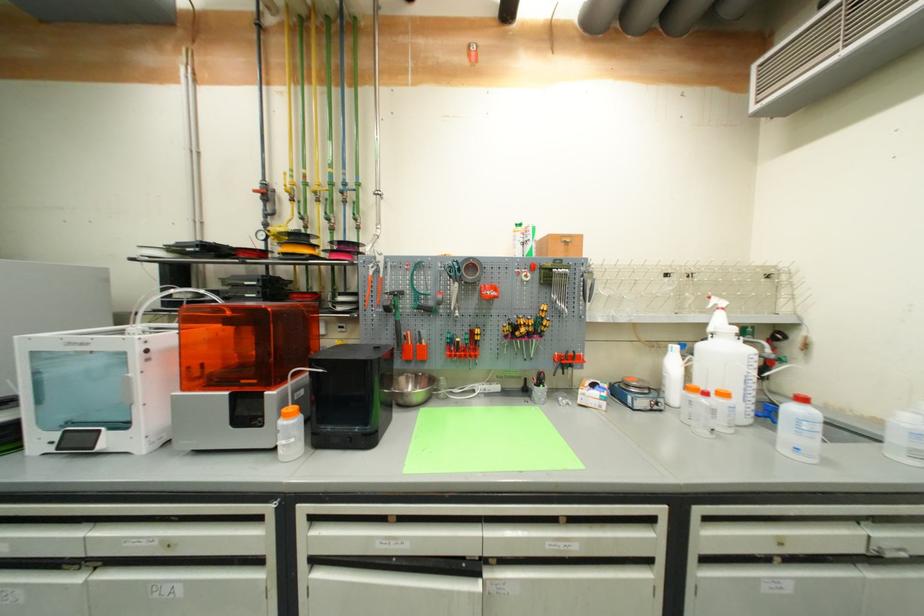
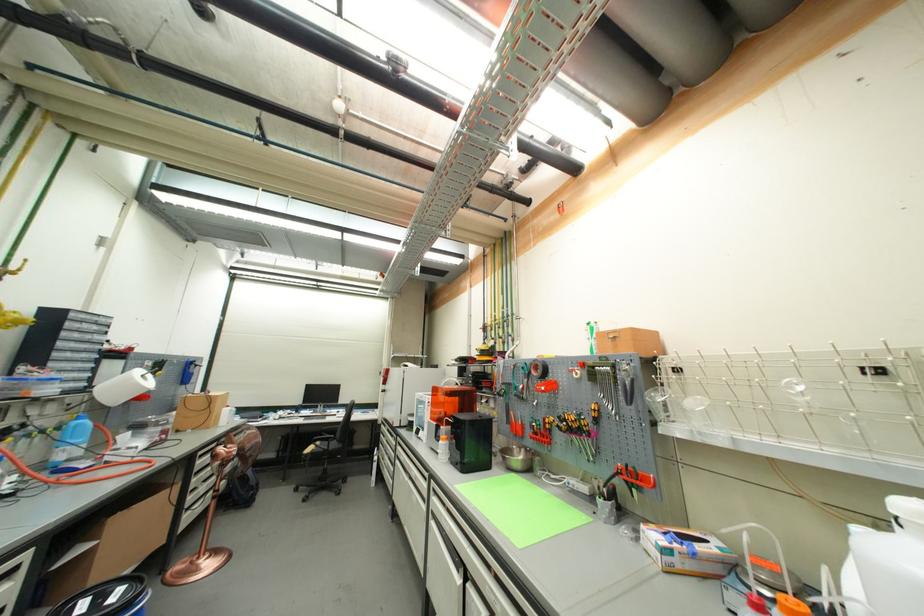
Locate, in the second image, the point that corresponds to point (551, 331) in the first image.

(592, 431)